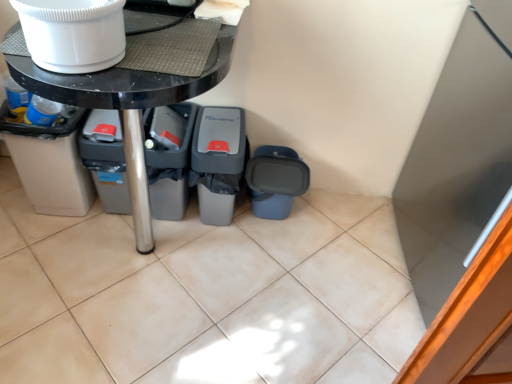
Question: In terms of size, does gray plastic bin at lower left appear bigger or smaller than white glossy toilet bowl at upper left?

Choices:
 (A) small
 (B) big

Answer: (B)

Question: From the image's perspective, is gray plastic bin at lower left above or below white glossy toilet bowl at upper left?

Choices:
 (A) above
 (B) below

Answer: (B)

Question: Based on their relative distances, which object is nearer to the gray plastic bin at lower left?

Choices:
 (A) beige plastic recycling bin at lower left, placed as the 4th recycling bin when sorted from right to left
 (B) black glossy table at center
 (C) blue matte recycling bin at lower right, which is the 4th recycling bin in left-to-right order
 (D) gray plastic recycling bin at center, which is counted as the third recycling bin, starting from the right
 (E) white glossy refrigerator at upper right

Answer: (D)

Question: Considering the real-world distances, which object is farthest from the black glossy table at center?

Choices:
 (A) white glossy refrigerator at upper right
 (B) gray plastic recycling bin at center, marked as the 3th recycling bin in a left-to-right arrangement
 (C) gray plastic recycling bin at center, placed as the second recycling bin when sorted from left to right
 (D) white glossy toilet bowl at upper left
 (E) blue matte recycling bin at lower right, which appears as the 1th recycling bin when viewed from the right

Answer: (A)